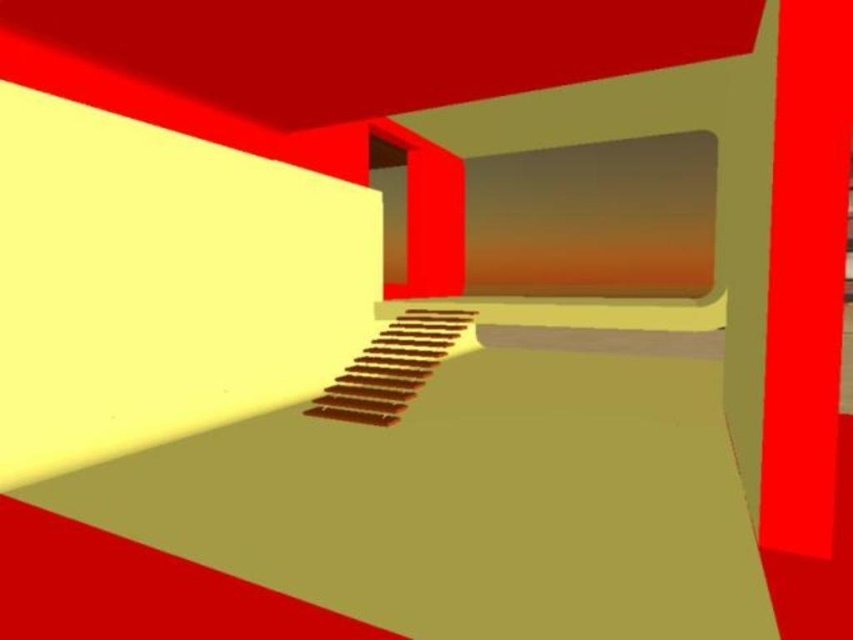
Is point (782, 349) closer to viewer compared to point (328, 406)?

Yes, point (782, 349) is in front of point (328, 406).

Does smooth glossy red pillar at right come in front of wooden stairs at center?

Yes, smooth glossy red pillar at right is closer to the viewer.

Find the location of a particular element. The height and width of the screenshot is (640, 853). smooth glossy red pillar at right is located at coordinates (805, 275).